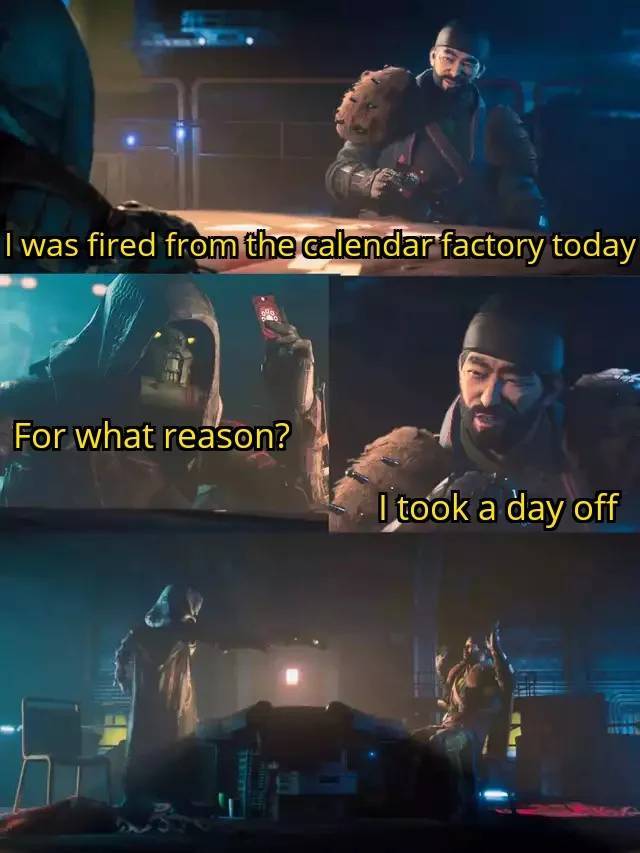
Image resolution: width=640 pixels, height=853 pixels. Find the location of `light`. light is located at coordinates (292, 674).